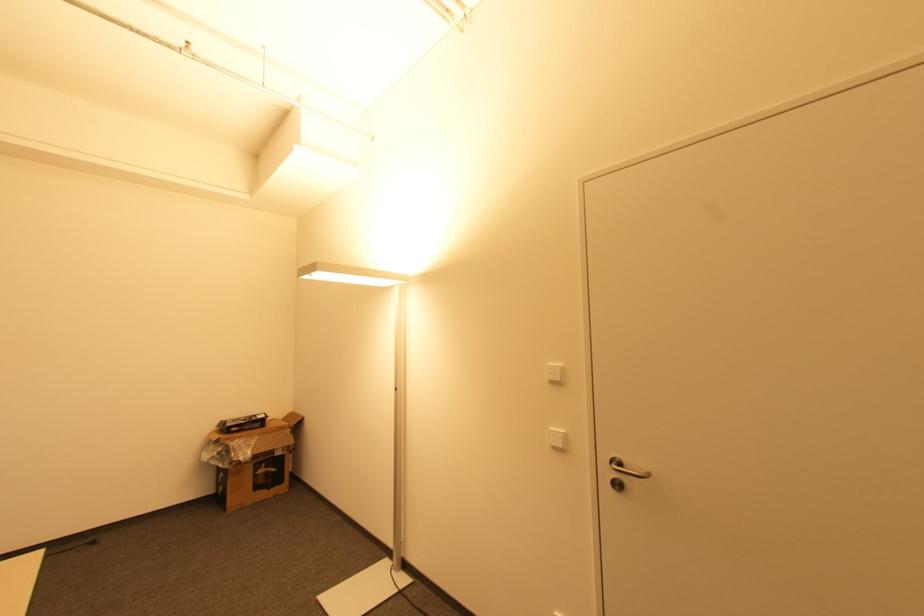
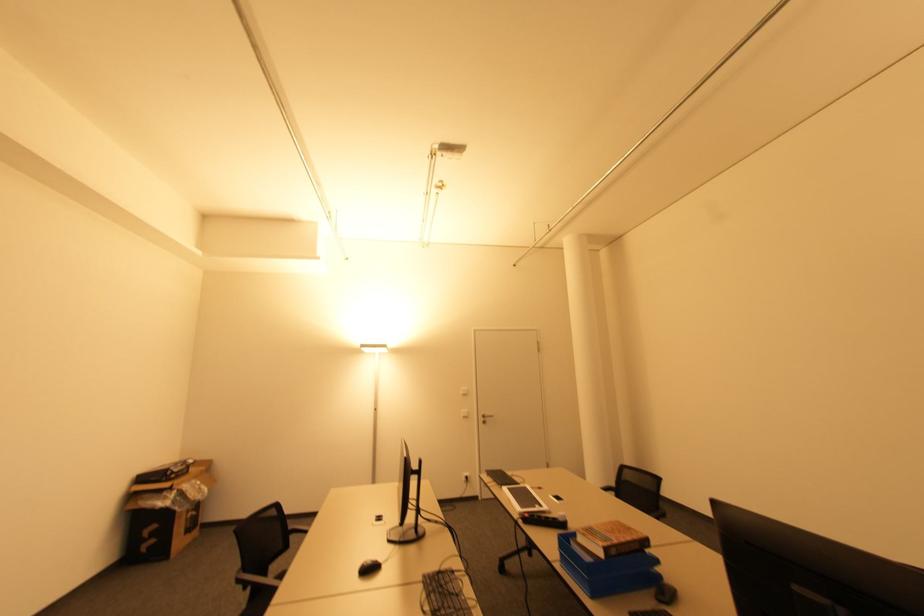
In the second image, find the point that corresponds to (x=560, y=379) in the first image.

(468, 392)